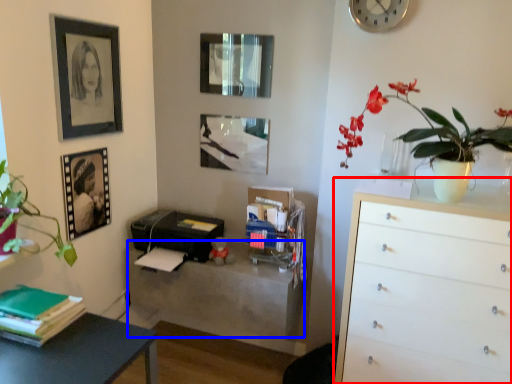
Question: Which of the following is the closest to the observer, chest of drawers (highlighted by a red box) or table (highlighted by a blue box)?

Choices:
 (A) chest of drawers
 (B) table

Answer: (A)